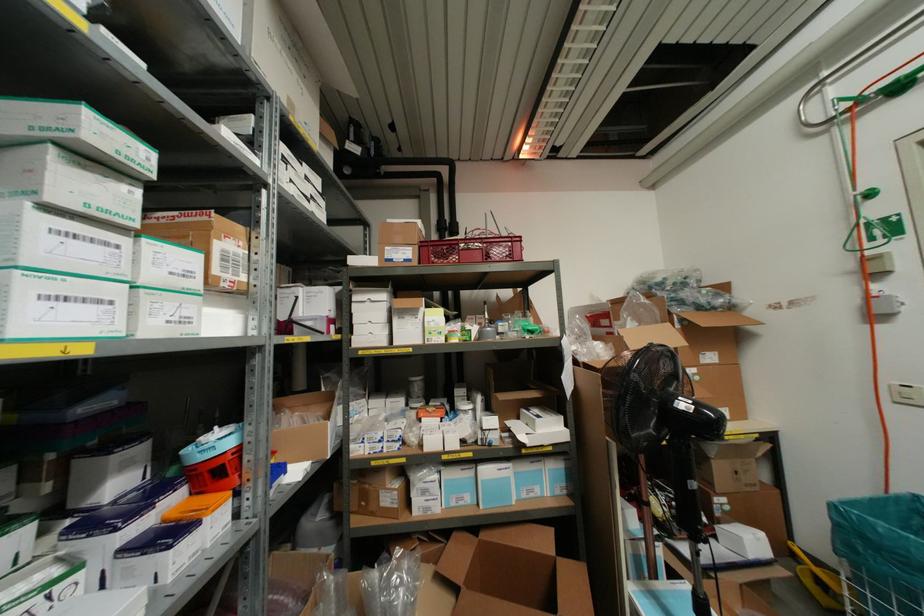
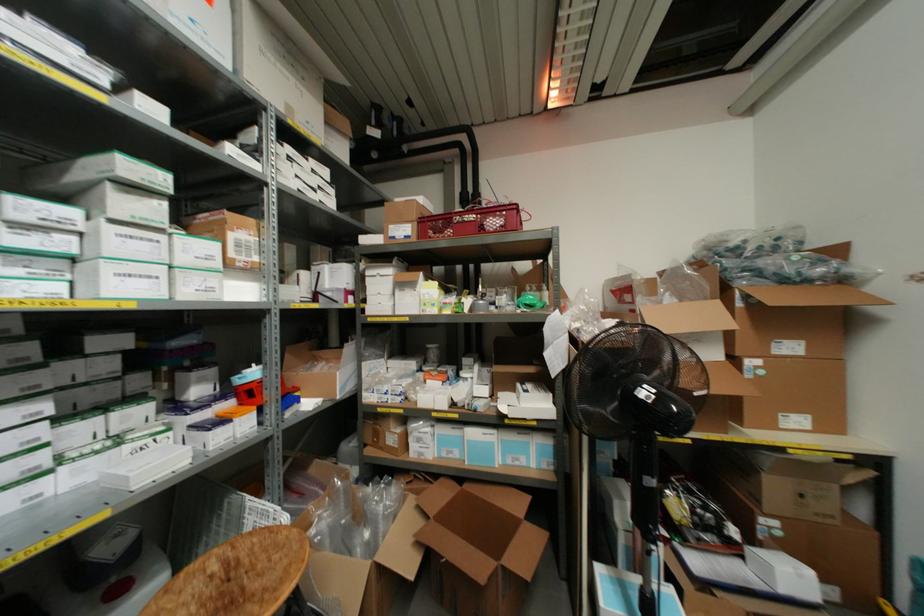
Question: The images are taken continuously from a first-person perspective. In which direction are you moving?

Choices:
 (A) Left
 (B) Right
 (C) Forward
 (D) Backward

Answer: (B)